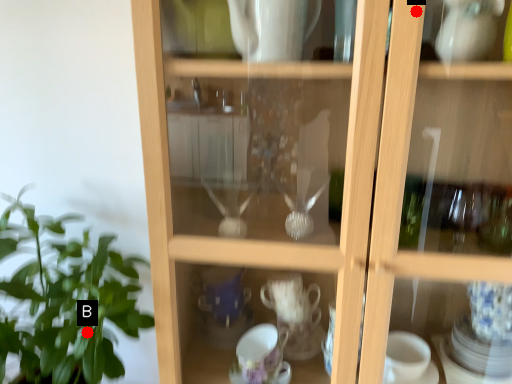
Question: Two points are circled on the image, labeled by A and B beside each circle. Which point appears closest to the camera in this image?

Choices:
 (A) A is closer
 (B) B is closer

Answer: (A)